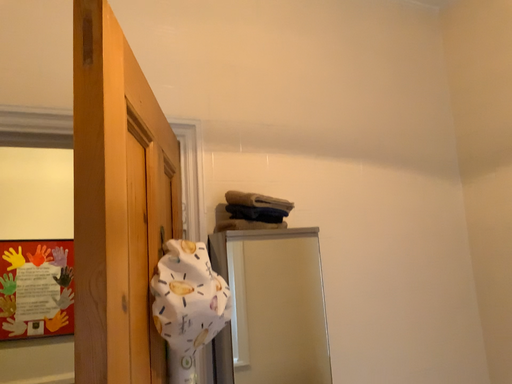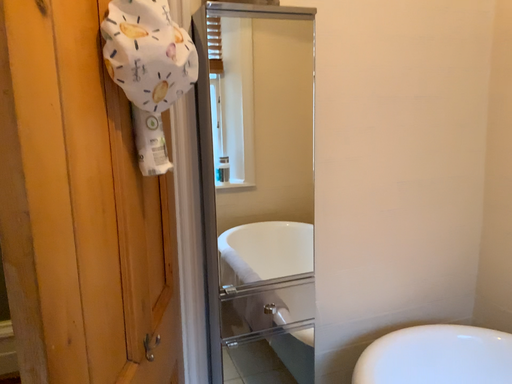
Question: Which way did the camera rotate in the video?

Choices:
 (A) rotated upward
 (B) rotated downward

Answer: (B)